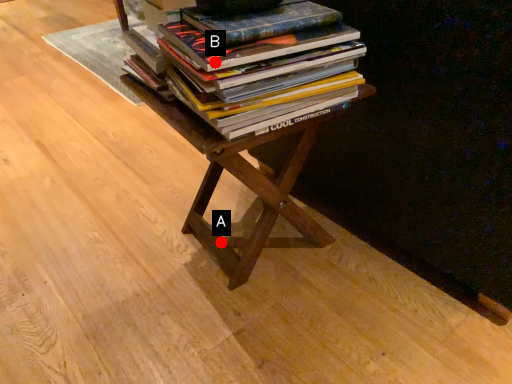
Question: Two points are circled on the image, labeled by A and B beside each circle. Which point appears farthest from the camera in this image?

Choices:
 (A) A is further
 (B) B is further

Answer: (A)